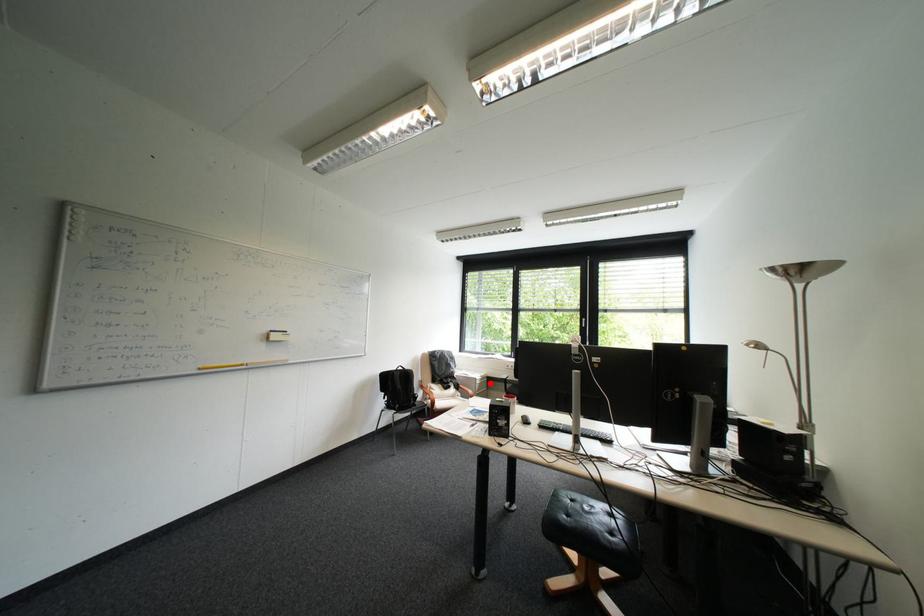
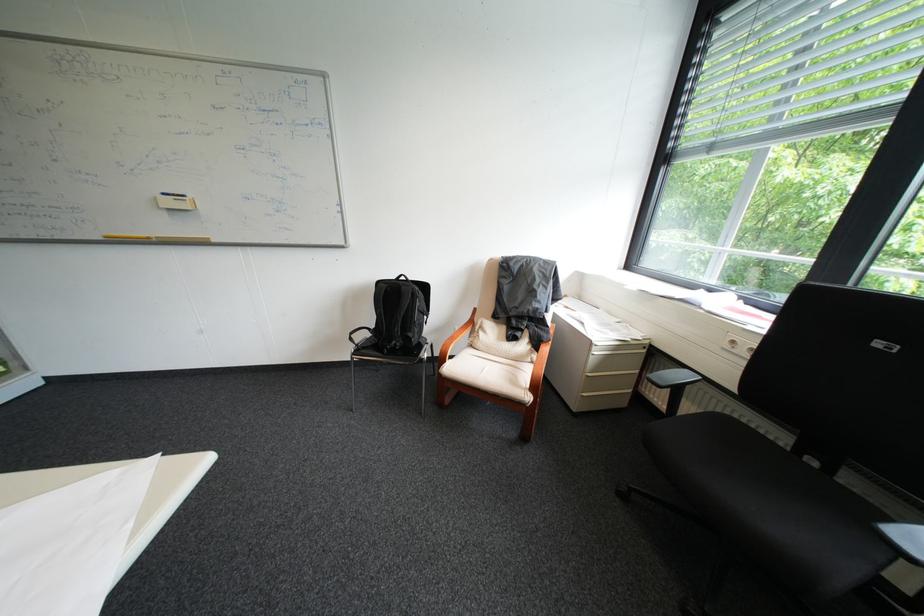
In the second image, find the point that corresponds to the highlighted location in the first image.

(609, 353)